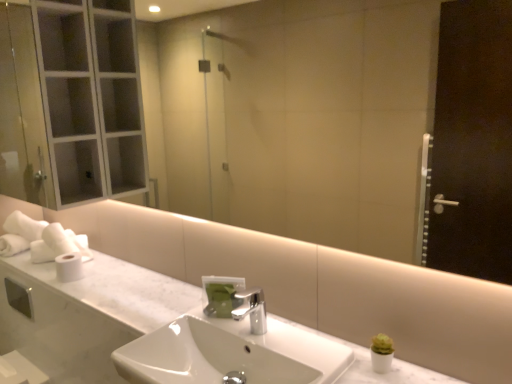
Locate an element on the screen. The image size is (512, 384). vacant area that is in front of white matte toilet paper at left, which ranks as the second toilet paper in back-to-front order is located at coordinates (66, 287).